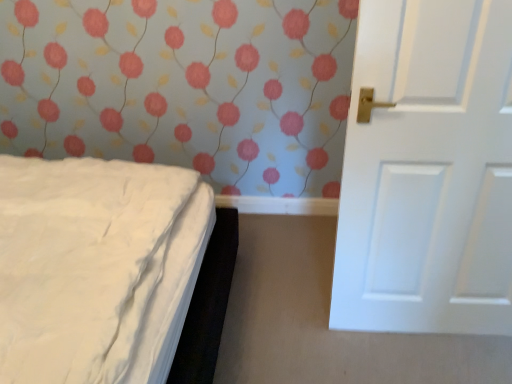
I want to click on vacant area in front of white matte door at right, so [x=437, y=359].